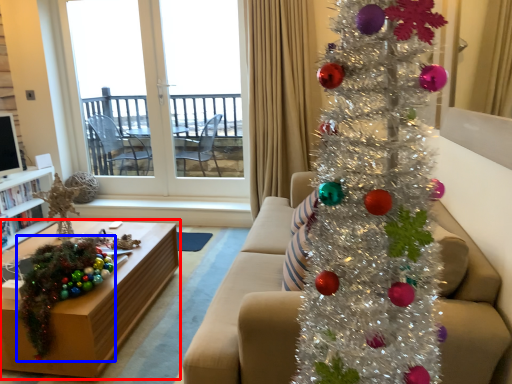
Question: Which object appears closest to the camera in this image, table (highlighted by a red box) or christmas decoration (highlighted by a blue box)?

Choices:
 (A) table
 (B) christmas decoration

Answer: (B)